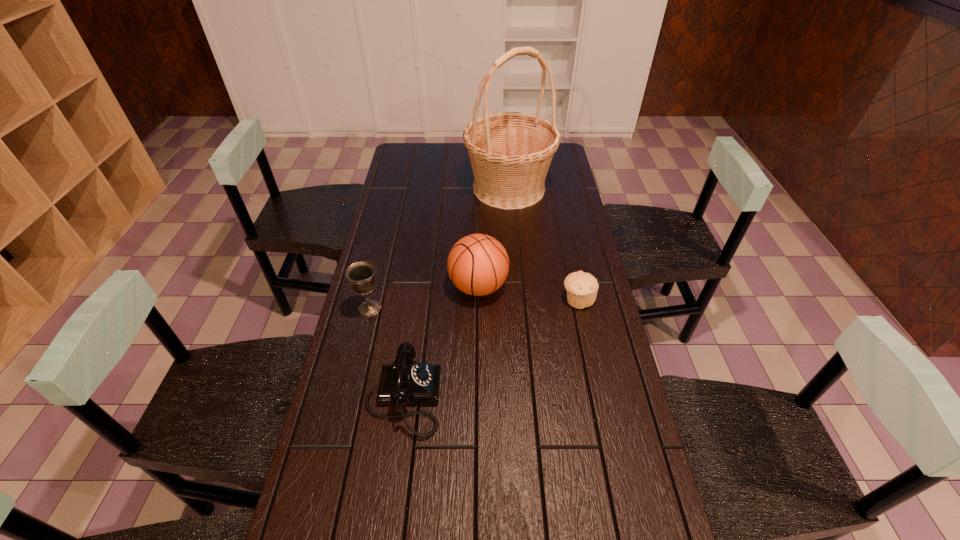
You are a GUI agent. You are given a task and a screenshot of the screen. Output one action in this format:
    pyautogui.click(x=<x>, y=<y>)
    Task: Click on the free space located 0.380m on the back of the leftmost object
    The image size is (960, 540).
    Given the screenshot: What is the action you would take?
    pyautogui.click(x=390, y=225)

You are a GUI agent. You are given a task and a screenshot of the screen. Output one action in this format:
    pyautogui.click(x=<x>, y=<y>)
    Task: Click on the blank space located 0.230m on the dial of the second object from left to right
    The height and width of the screenshot is (540, 960).
    Given the screenshot: What is the action you would take?
    pyautogui.click(x=527, y=397)

This screenshot has height=540, width=960. Identify the location of vacant region located on the back of the muffin. (571, 267).

You are a GUI agent. You are given a task and a screenshot of the screen. Output one action in this format:
    pyautogui.click(x=<x>, y=<y>)
    Task: Click on the object located in the far edge section of the desktop
    This screenshot has height=540, width=960.
    Given the screenshot: What is the action you would take?
    pyautogui.click(x=510, y=152)

You are a GUI agent. You are given a task and a screenshot of the screen. Output one action in this format:
    pyautogui.click(x=<x>, y=<y>)
    Task: Click on the chalice present at the left edge
    Image resolution: width=960 pixels, height=540 pixels.
    Given the screenshot: What is the action you would take?
    pyautogui.click(x=360, y=274)

You are a GUI agent. You are given a task and a screenshot of the screen. Output one action in this format:
    pyautogui.click(x=<x>, y=<y>)
    Task: Click on the telephone situated at the left edge
    The width and height of the screenshot is (960, 540).
    Given the screenshot: What is the action you would take?
    pyautogui.click(x=405, y=381)

Identify the location of basket situated at the right edge. (510, 152).

The width and height of the screenshot is (960, 540). What are the coordinates of `muffin at the right edge` in the screenshot? It's located at (581, 287).

In order to click on object positioned at the far right corner in this screenshot , I will do `click(510, 152)`.

The image size is (960, 540). In the image, there is a desktop. In order to click on free space at the far edge in this screenshot , I will do `click(439, 166)`.